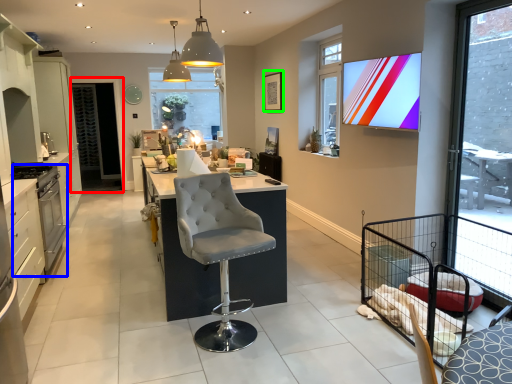
Question: Estimate the real-world distances between objects in this image. Which object is farther from screen door (highlighted by a red box), appliance (highlighted by a blue box) or picture frame (highlighted by a green box)?

Choices:
 (A) appliance
 (B) picture frame

Answer: (A)